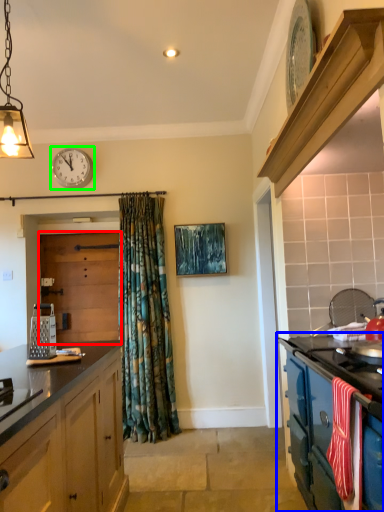
Question: Which object is positioned closest to door (highlighted by a red box)? Select from cabinetry (highlighted by a blue box) and clock (highlighted by a green box).

Choices:
 (A) cabinetry
 (B) clock

Answer: (B)